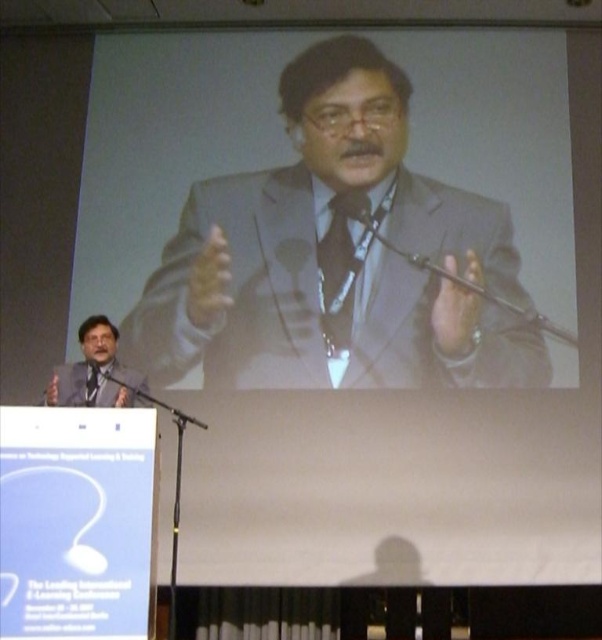
Is point (344, 246) farther from camera compared to point (166, 406)?

That is True.

What do you see at coordinates (340, 269) in the screenshot? The height and width of the screenshot is (640, 602). I see `matte black tie at center` at bounding box center [340, 269].

Identify the location of matte black tie at center. The image size is (602, 640). (340, 269).

Who is more distant from viewer, (150, 308) or (346, 205)?

Positioned behind is point (346, 205).

Is matte gray suit at center to the left of matte black tie at center from the viewer's perspective?

Yes, matte gray suit at center is to the left of matte black tie at center.

Which is in front, point (391, 264) or point (326, 260)?

Point (391, 264)

Image resolution: width=602 pixels, height=640 pixels. I want to click on matte gray suit at center, so click(335, 257).

Is matte gray suit at center positioned at the back of black matte microphone at lower left?

Yes, it is behind black matte microphone at lower left.

Is matte gray suit at center to the left of black matte microphone at lower left from the viewer's perspective?

No, matte gray suit at center is not to the left of black matte microphone at lower left.

This screenshot has height=640, width=602. I want to click on matte gray suit at center, so click(335, 257).